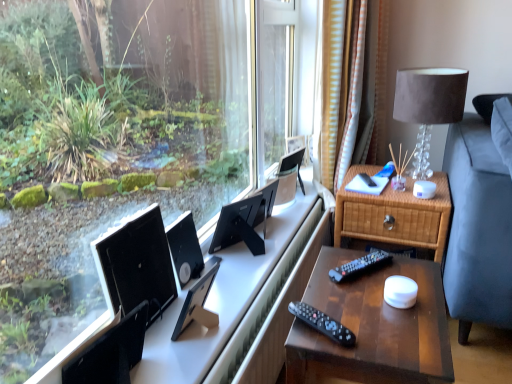
Locate an element on the screen. vacant space to the right of black matte computer monitor at center, which is counted as the third computer monitor, starting from the front is located at coordinates (228, 282).